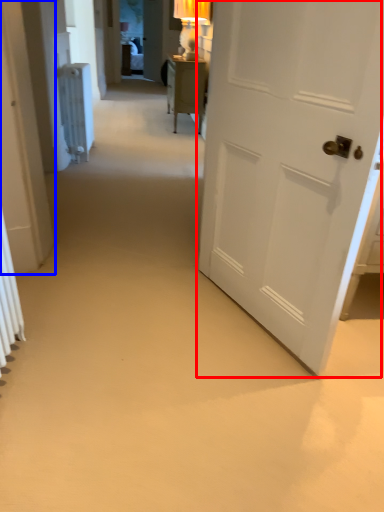
Question: Which object appears farthest to the camera in this image, door (highlighted by a red box) or door (highlighted by a blue box)?

Choices:
 (A) door
 (B) door

Answer: (B)